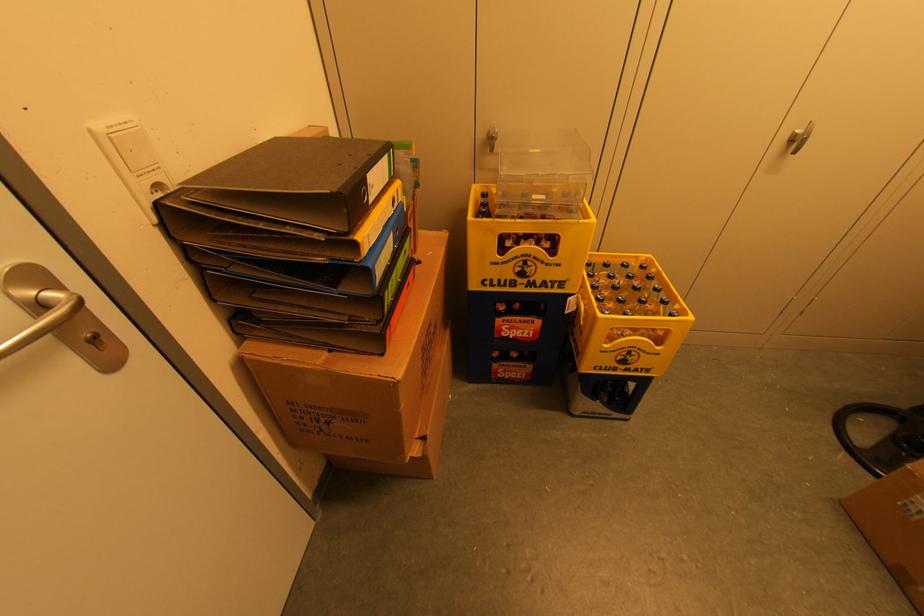
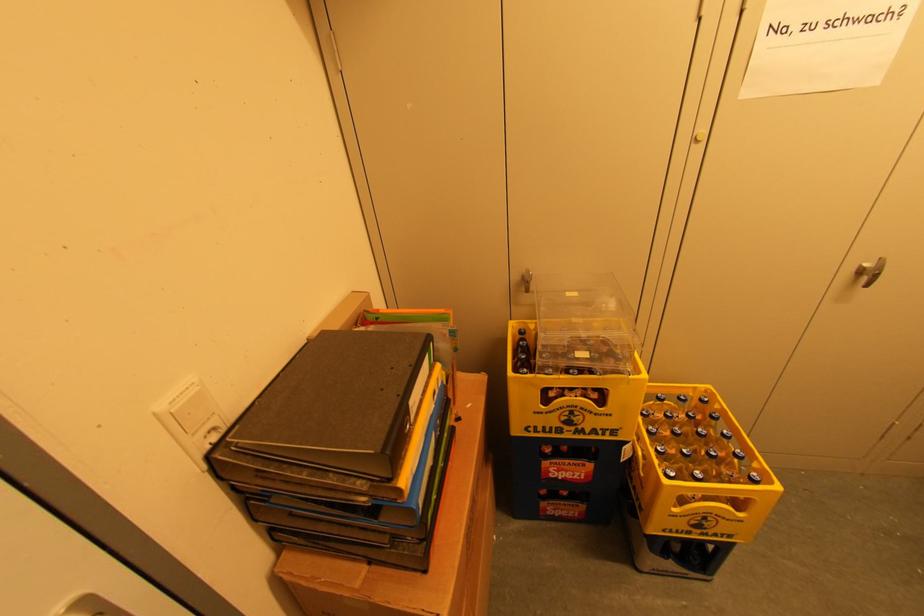
The point at (x=638, y=370) is marked in the first image. Where is the corresponding point in the second image?

(718, 535)